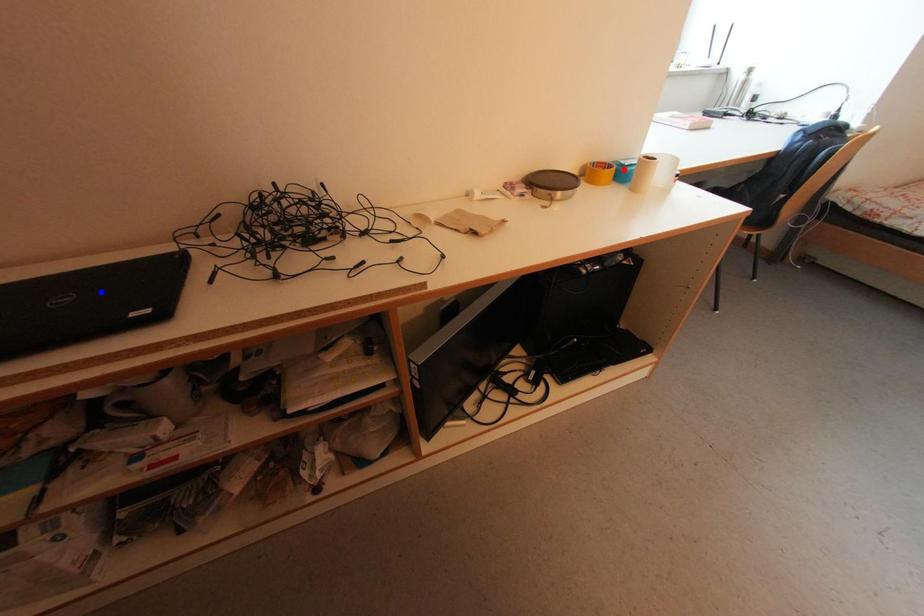
Question: In the image, two points are highlighted. Which point is nearer to the camera? Reply with the corresponding letter.

Choices:
 (A) blue point
 (B) red point

Answer: (A)